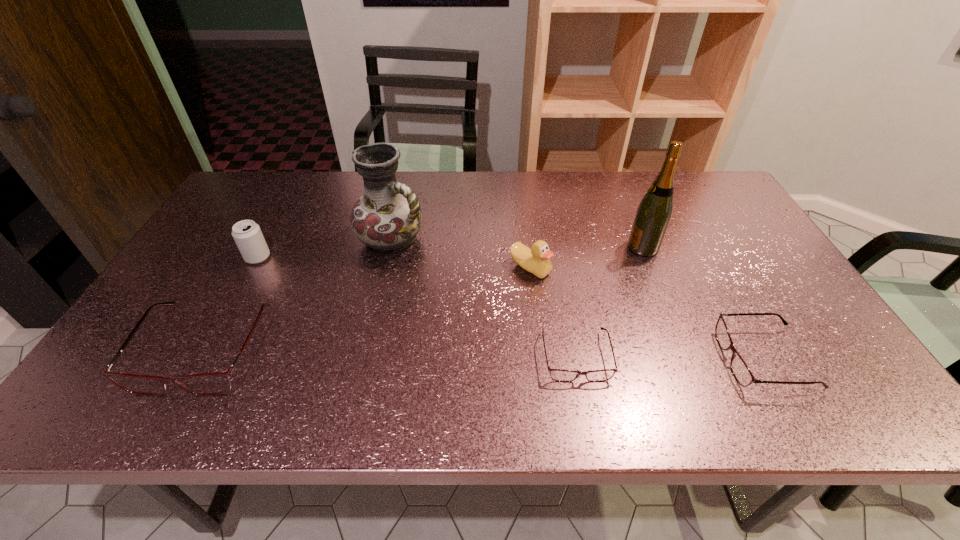
Locate an element on the screen. the tallest spectacles is located at coordinates (207, 384).

Locate an element on the screen. The height and width of the screenshot is (540, 960). the leftmost spectacles is located at coordinates (207, 384).

At what (x,y) coordinates should I click in order to perform the action: click on the second spectacles from right to left. Please return your answer as a coordinate pair (x, y). The image size is (960, 540). Looking at the image, I should click on (560, 375).

Locate an element on the screen. the shortest object is located at coordinates (560, 375).

You are a GUI agent. You are given a task and a screenshot of the screen. Output one action in this format:
    pyautogui.click(x=<x>, y=<y>)
    Task: Click on the second tallest spectacles
    Image resolution: width=960 pixels, height=540 pixels.
    Given the screenshot: What is the action you would take?
    pyautogui.click(x=740, y=370)

Locate an element on the screen. the second shortest object is located at coordinates (740, 370).

What are the coordinates of `duck` in the screenshot? It's located at (536, 260).

You are a GUI agent. You are given a task and a screenshot of the screen. Output one action in this format:
    pyautogui.click(x=<x>, y=<y>)
    Task: Click on the wine bottle
    The height and width of the screenshot is (540, 960).
    Given the screenshot: What is the action you would take?
    pyautogui.click(x=653, y=215)

Identify the location of the second tallest object. pos(387,218).

Identify the location of the third object from left to right. (387, 218).